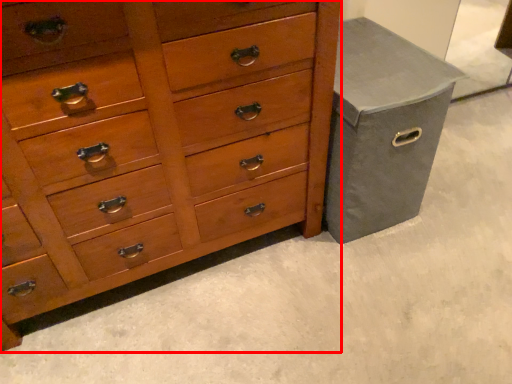
Question: From the image's perspective, where is chest of drawers (annotated by the red box) located relative to gray?

Choices:
 (A) above
 (B) below

Answer: (B)